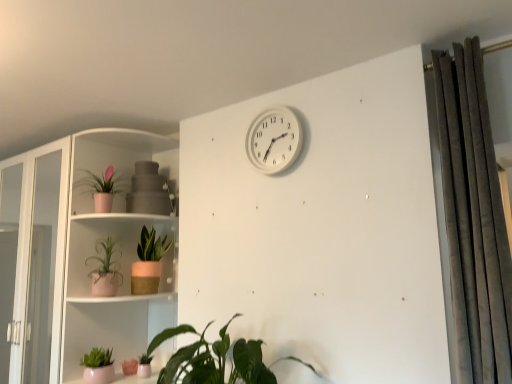
Question: Is point (142, 230) positioned closer to the camera than point (25, 192)?

Choices:
 (A) farther
 (B) closer

Answer: (A)

Question: From the image's perspective, is green matte plant pot at center-left, marked as the sixth houseplant in a front-to-back arrangement, positioned above or below pink ceramic plant at left?

Choices:
 (A) above
 (B) below

Answer: (A)

Question: Estimate the real-world distances between objects in this image. Which object is closer to the pink matte pot at lower left, which is the 5th houseplant in front-to-back order?

Choices:
 (A) white plastic wall clock at upper center
 (B) matte pink pot at left, which is the third houseplant in back-to-front order
 (C) matte pink pot at lower left, arranged as the 2th houseplant when viewed from the front
 (D) green matte plant pot at center-left, marked as the sixth houseplant in a front-to-back arrangement
 (E) dark gray velvet curtain at right

Answer: (C)

Question: Which of these objects is positioned closest to the white plastic wall clock at upper center?

Choices:
 (A) pink matte pot at lower left, the 2th houseplant viewed from the back
 (B) green matte plant pot at center-left, the 1th houseplant in the back-to-front sequence
 (C) green matte houseplant at lower center, the first houseplant from the front
 (D) pink ceramic plant at left
 (E) matte pink pot at left, which is the 4th houseplant from front to back

Answer: (C)